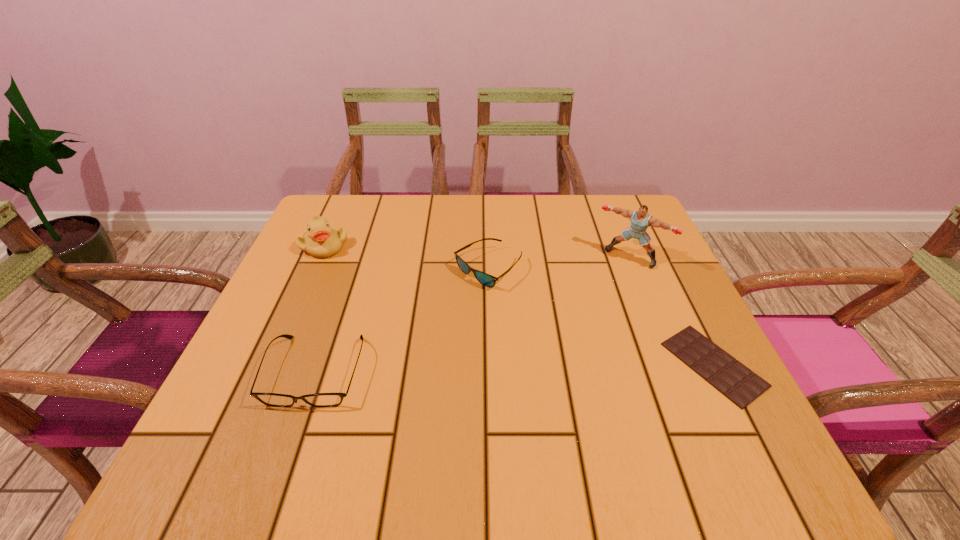
You are a GUI agent. You are given a task and a screenshot of the screen. Output one action in this format:
    pyautogui.click(x=<x>, y=<y>)
    Task: Click on the vacant area situated on the front-facing side of the second tallest object
    This screenshot has width=960, height=540.
    Given the screenshot: What is the action you would take?
    pyautogui.click(x=396, y=303)

At what (x,y) coordinates should I click in order to perform the action: click on free space located on the front-facing side of the second tallest object. Please return your answer as a coordinate pair (x, y). The width and height of the screenshot is (960, 540). Looking at the image, I should click on (368, 280).

Locate an element on the screen. free space located on the front-facing side of the tallest object is located at coordinates (561, 346).

You are a GUI agent. You are given a task and a screenshot of the screen. Output one action in this format:
    pyautogui.click(x=<x>, y=<y>)
    Task: Click on the vacant space located on the front-facing side of the tallest object
    Image resolution: width=960 pixels, height=540 pixels.
    Given the screenshot: What is the action you would take?
    pyautogui.click(x=567, y=336)

Locate an element on the screen. The height and width of the screenshot is (540, 960). free space located on the front-facing side of the tallest object is located at coordinates (567, 336).

The height and width of the screenshot is (540, 960). Find the location of `duckling positioned at the far edge`. duckling positioned at the far edge is located at coordinates (322, 240).

Find the location of a particular element. puncher located in the far edge section of the desktop is located at coordinates (640, 220).

Find the location of a particular element. spectacles that is at the near edge is located at coordinates (270, 399).

Identify the location of chocolate bar that is at the near edge. (738, 383).

Where is `spectacles present at the left edge`? This screenshot has width=960, height=540. spectacles present at the left edge is located at coordinates (270, 399).